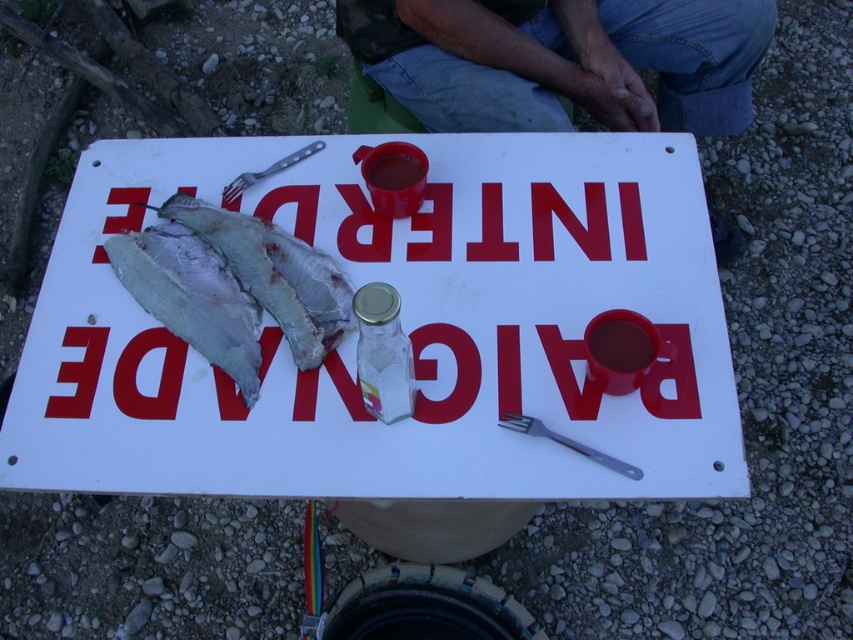
You are a photographer taking a picture of the scene. You notice the jeans at upper center and the white flaky fish at center. Which object is positioned higher in the image?

The jeans at upper center is positioned higher than the white flaky fish at center.

You are standing at the point with coordinates point (636, 61) and want to walk towards the point with coordinates point (293, 237). Will you be moving forward or backward relative to the direction you are facing?

Since point (636, 61) is behind point (293, 237), you would be moving forward towards the point (293, 237) if you are facing that direction.